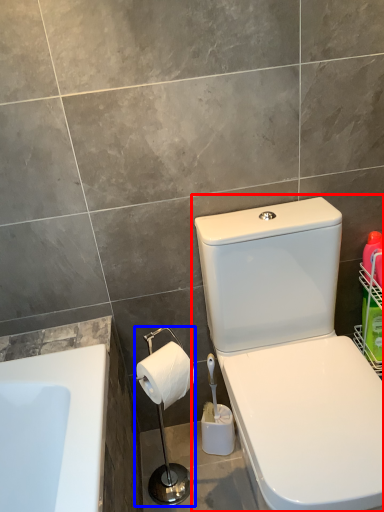
Question: Which of the following is the closest to the observer, toilet (highlighted by a red box) or shower (highlighted by a blue box)?

Choices:
 (A) toilet
 (B) shower

Answer: (A)